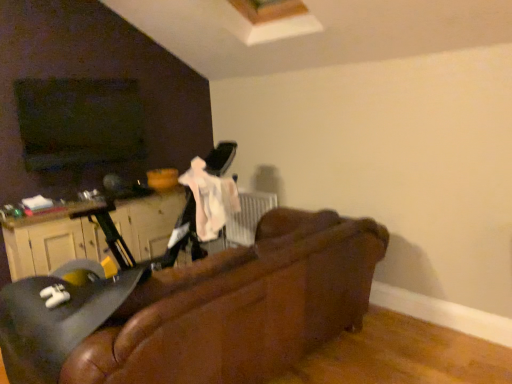
Question: Can you confirm if leather couch at center is taller than matte black swivel chair at left?

Choices:
 (A) yes
 (B) no

Answer: (A)

Question: Is leather couch at center thinner than matte black swivel chair at left?

Choices:
 (A) no
 (B) yes

Answer: (A)

Question: Is matte black swivel chair at left completely or partially inside leather couch at center?

Choices:
 (A) yes
 (B) no

Answer: (A)

Question: Is leather couch at center closer to the viewer compared to matte black swivel chair at left?

Choices:
 (A) yes
 (B) no

Answer: (A)

Question: From a real-world perspective, is leather couch at center positioned under matte black swivel chair at left based on gravity?

Choices:
 (A) no
 (B) yes

Answer: (B)

Question: Considering their positions, is matte black swivel chair at left located in front of or behind leather couch at center?

Choices:
 (A) front
 (B) behind

Answer: (B)

Question: Considering the positions of matte black swivel chair at left and leather couch at center in the image, is matte black swivel chair at left bigger or smaller than leather couch at center?

Choices:
 (A) big
 (B) small

Answer: (B)

Question: Choose the correct answer: Is matte black swivel chair at left inside leather couch at center or outside it?

Choices:
 (A) inside
 (B) outside

Answer: (A)

Question: Would you say matte black swivel chair at left is to the left or to the right of leather couch at center in the picture?

Choices:
 (A) left
 (B) right

Answer: (A)

Question: Looking at the image, does wooden dresser at left seem bigger or smaller compared to leather couch at center?

Choices:
 (A) big
 (B) small

Answer: (B)

Question: From their relative heights in the image, would you say wooden dresser at left is taller or shorter than leather couch at center?

Choices:
 (A) tall
 (B) short

Answer: (B)

Question: Looking at their shapes, would you say wooden dresser at left is wider or thinner than leather couch at center?

Choices:
 (A) thin
 (B) wide

Answer: (A)

Question: In the image, is wooden dresser at left on the left side or the right side of leather couch at center?

Choices:
 (A) right
 (B) left

Answer: (B)

Question: Considering their positions, is matte black swivel chair at left located in front of or behind wooden dresser at left?

Choices:
 (A) front
 (B) behind

Answer: (A)

Question: From the image's perspective, is matte black swivel chair at left positioned above or below wooden dresser at left?

Choices:
 (A) above
 (B) below

Answer: (B)